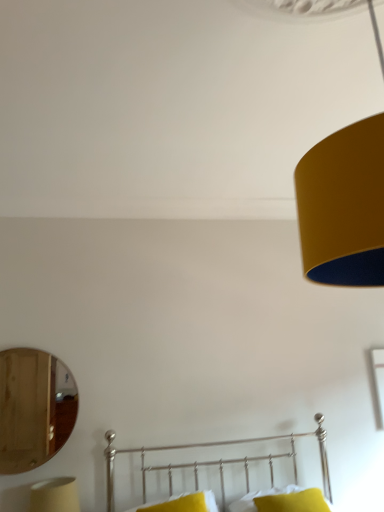
Question: Is yellow fabric pillow at lower center, which appears as the first pillow when viewed from the left, looking in the opposite direction of matte yellow lampshade at lower left?

Choices:
 (A) yes
 (B) no

Answer: (B)

Question: Is yellow fabric pillow at lower center, which appears as the first pillow when viewed from the left, not close to matte yellow lampshade at lower left?

Choices:
 (A) no
 (B) yes

Answer: (A)

Question: Is matte yellow lampshade at lower left a part of yellow fabric pillow at lower center, which appears as the first pillow when viewed from the left?

Choices:
 (A) no
 (B) yes

Answer: (A)

Question: Is yellow fabric pillow at lower center, which is the second pillow in right-to-left order, next to matte yellow lampshade at lower left?

Choices:
 (A) no
 (B) yes

Answer: (A)

Question: Considering the relative sizes of yellow fabric pillow at lower center, which is the second pillow in right-to-left order, and matte yellow lampshade at lower left in the image provided, is yellow fabric pillow at lower center, which is the second pillow in right-to-left order, thinner than matte yellow lampshade at lower left?

Choices:
 (A) no
 (B) yes

Answer: (A)

Question: Considering the relative positions of yellow fabric pillow at lower center, which is the second pillow in right-to-left order, and wooden mirror at left in the image provided, is yellow fabric pillow at lower center, which is the second pillow in right-to-left order, to the left or to the right of wooden mirror at left?

Choices:
 (A) right
 (B) left

Answer: (A)

Question: Considering the positions of yellow fabric pillow at lower center, which appears as the first pillow when viewed from the left, and wooden mirror at left in the image, is yellow fabric pillow at lower center, which appears as the first pillow when viewed from the left, taller or shorter than wooden mirror at left?

Choices:
 (A) short
 (B) tall

Answer: (A)

Question: Is yellow fabric pillow at lower center, which is the second pillow in right-to-left order, situated inside wooden mirror at left or outside?

Choices:
 (A) inside
 (B) outside

Answer: (B)

Question: Is yellow fabric pillow at lower center, which is the second pillow in right-to-left order, wider or thinner than wooden mirror at left?

Choices:
 (A) thin
 (B) wide

Answer: (B)

Question: From a real-world perspective, is yellow fabric pillow at lower center, which is the second pillow in right-to-left order, above or below metallic silver bed at lower center?

Choices:
 (A) below
 (B) above

Answer: (A)

Question: Considering the positions of yellow fabric pillow at lower center, which is the second pillow in right-to-left order, and metallic silver bed at lower center in the image, is yellow fabric pillow at lower center, which is the second pillow in right-to-left order, taller or shorter than metallic silver bed at lower center?

Choices:
 (A) tall
 (B) short

Answer: (B)

Question: Looking at the image, does yellow fabric pillow at lower center, which appears as the first pillow when viewed from the left, seem bigger or smaller compared to metallic silver bed at lower center?

Choices:
 (A) small
 (B) big

Answer: (A)

Question: Considering the relative positions of yellow fabric pillow at lower center, which is the second pillow in right-to-left order, and metallic silver bed at lower center in the image provided, is yellow fabric pillow at lower center, which is the second pillow in right-to-left order, to the left or to the right of metallic silver bed at lower center?

Choices:
 (A) left
 (B) right

Answer: (A)

Question: Which is correct: metallic silver bed at lower center is inside wooden mirror at left, or outside of it?

Choices:
 (A) inside
 (B) outside

Answer: (B)

Question: Based on their positions, is metallic silver bed at lower center located to the left or right of wooden mirror at left?

Choices:
 (A) left
 (B) right

Answer: (B)